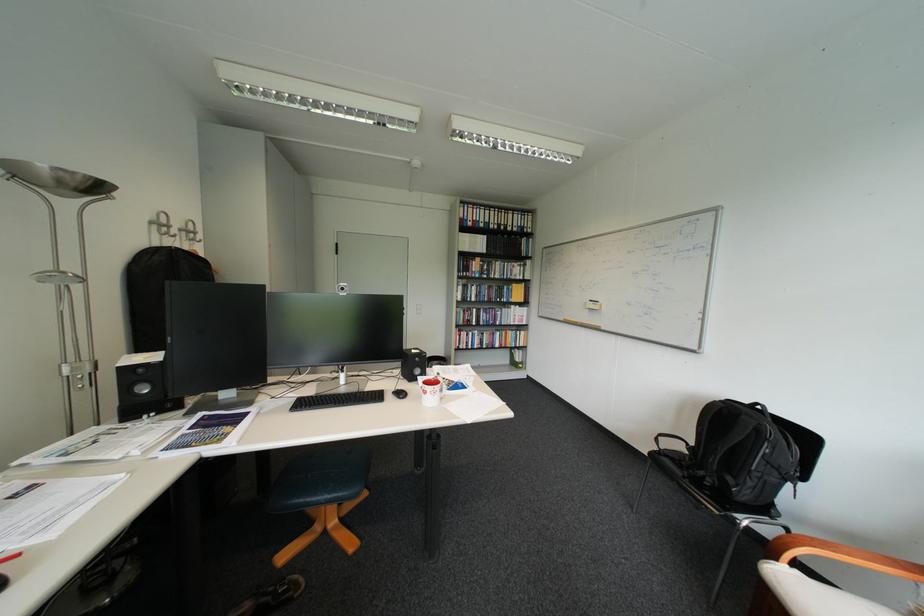
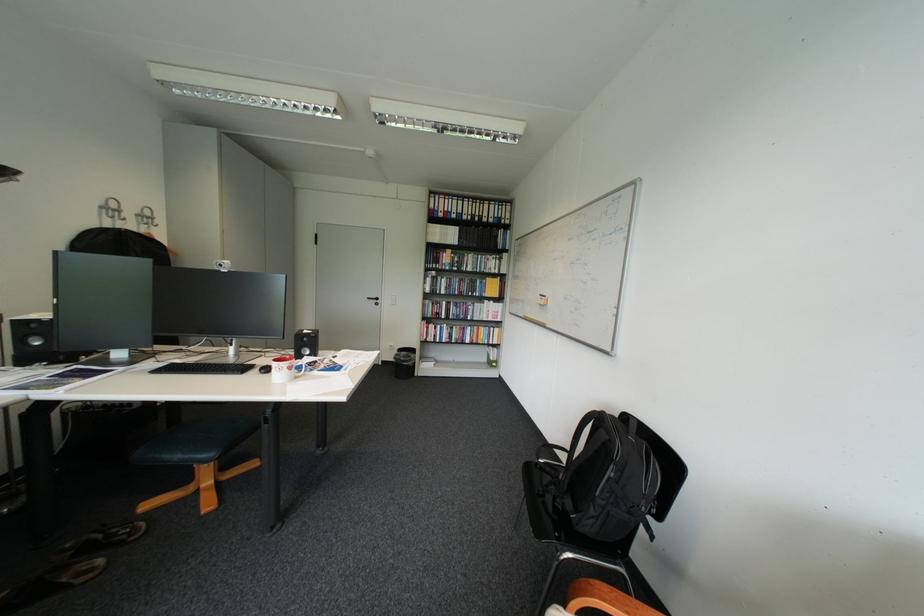
In the second image, find the point that corresponds to the point at 163,224 in the first image.

(114, 208)